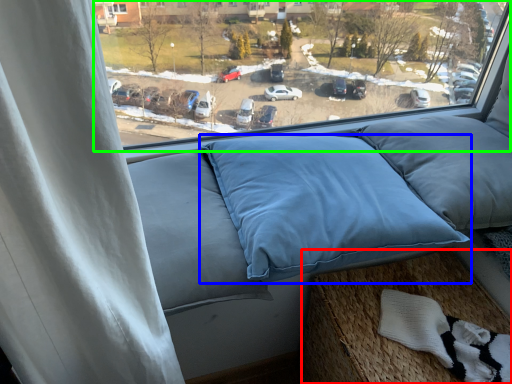
Question: Which object is the closest to the bed frame (highlighted by a red box)? Choose among these: pillow (highlighted by a blue box) or window (highlighted by a green box).

Choices:
 (A) pillow
 (B) window

Answer: (A)